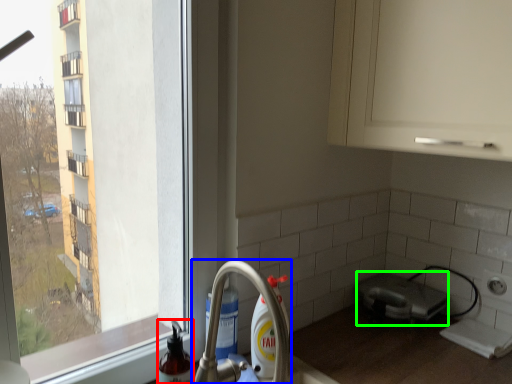
Question: Which object is the closest to the cleaning product (highlighted by a red box)? Choose among these: tap (highlighted by a blue box) or appliance (highlighted by a green box).

Choices:
 (A) tap
 (B) appliance

Answer: (A)